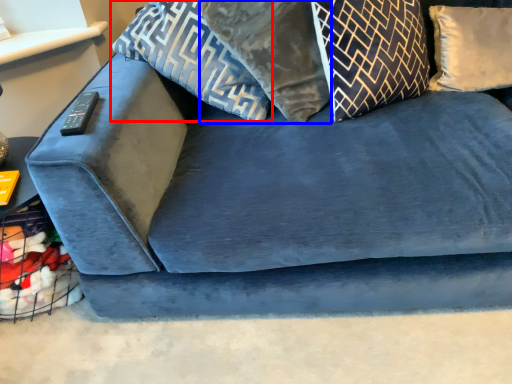
Question: Which object appears closest to the camera in this image, pillow (highlighted by a red box) or pillow (highlighted by a blue box)?

Choices:
 (A) pillow
 (B) pillow

Answer: (B)